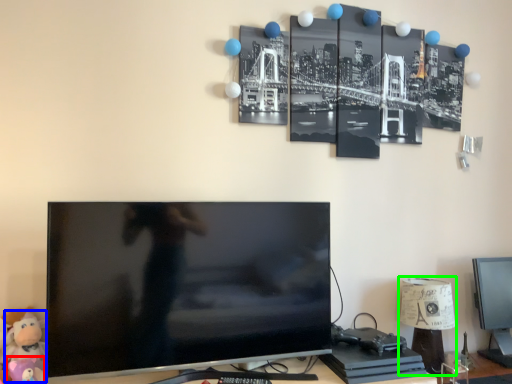
Question: Based on their relative distances, which object is nearer to toy (highlighted by a red box)? Choose from toy (highlighted by a blue box) and table lamp (highlighted by a green box).

Choices:
 (A) toy
 (B) table lamp

Answer: (A)